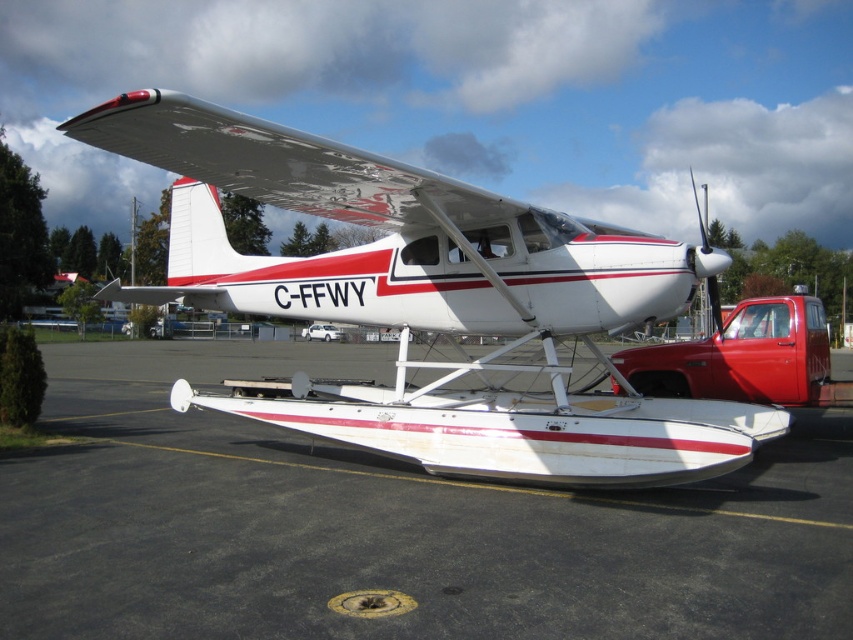
Can you confirm if white asphalt tarmac at center is positioned below white matte seaplane at center?

Yes, white asphalt tarmac at center is below white matte seaplane at center.

Where is `white asphalt tarmac at center`? This screenshot has width=853, height=640. white asphalt tarmac at center is located at coordinates (386, 524).

Who is higher up, metallic red pickup truck at center right or white matte car at center?

white matte car at center

Between point (793, 340) and point (321, 339), which one is positioned behind?

Positioned behind is point (321, 339).

Identify the location of metallic red pickup truck at center right. The image size is (853, 640). (743, 356).

Does white asphalt tarmac at center lie in front of white matte car at center?

That is True.

Can you confirm if white asphalt tarmac at center is positioned to the right of white matte car at center?

Correct, you'll find white asphalt tarmac at center to the right of white matte car at center.

Between point (549, 595) and point (318, 328), which one is positioned behind?

Point (318, 328)

This screenshot has width=853, height=640. In order to click on white asphalt tarmac at center in this screenshot , I will do `click(386, 524)`.